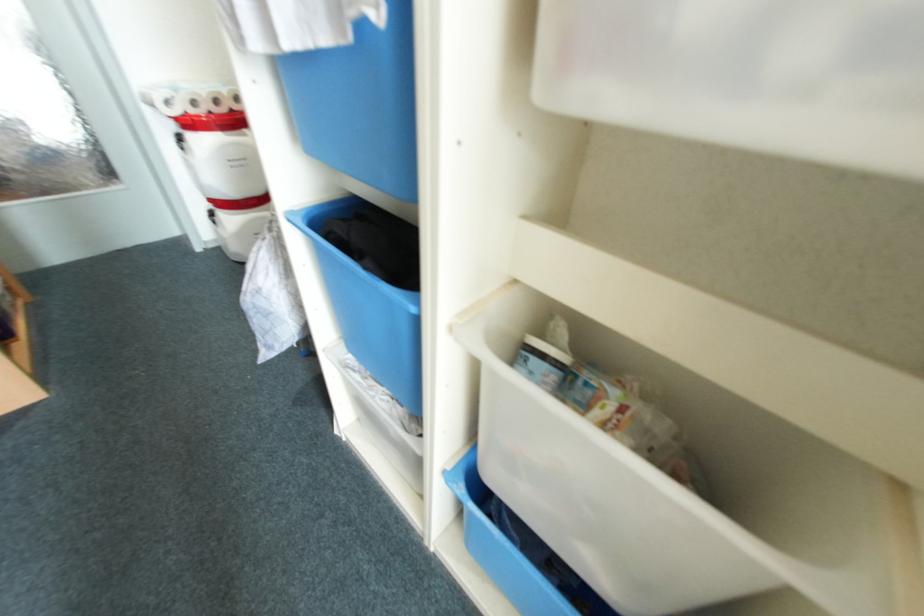
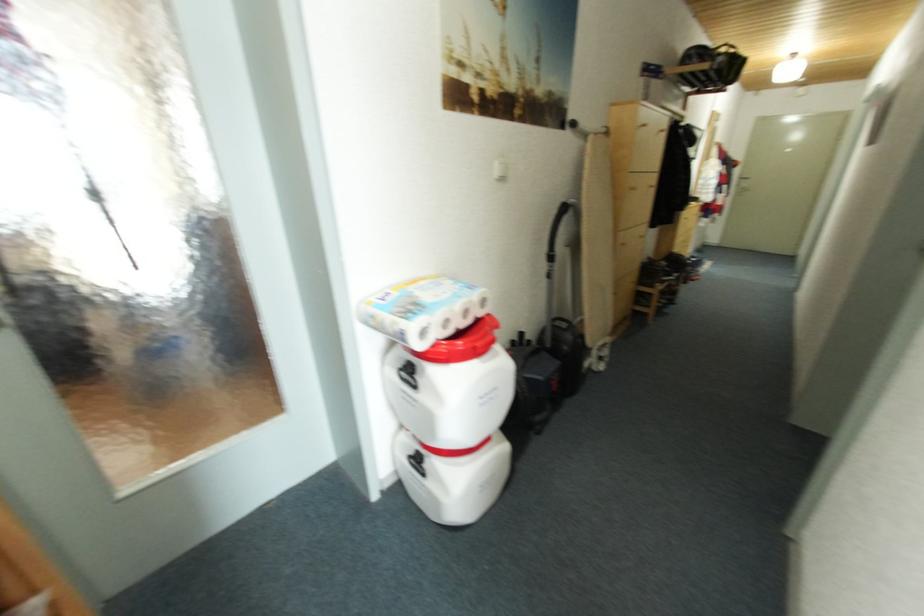
Which direction would the cameraman need to move to produce the second image?

The cameraman walked toward left, forward.